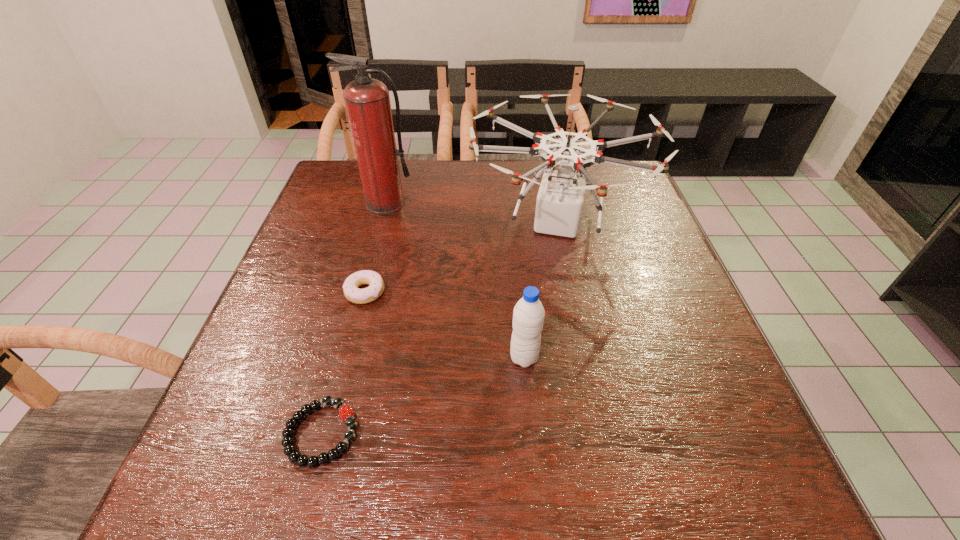
This screenshot has width=960, height=540. I want to click on vacant point located between the tallest object and the bracelet, so click(354, 319).

Identify the location of unoccupied position between the fire extinguisher and the second tallest object. Image resolution: width=960 pixels, height=540 pixels. (471, 213).

This screenshot has height=540, width=960. Find the location of `vacant area that lies between the water bottle and the second tallest object`. vacant area that lies between the water bottle and the second tallest object is located at coordinates (540, 290).

Find the location of `free space between the drone and the water bottle`. free space between the drone and the water bottle is located at coordinates (540, 290).

Identify the location of free space that is in between the bracelet and the fire extinguisher. This screenshot has width=960, height=540. (354, 319).

This screenshot has height=540, width=960. In order to click on free space between the fourth tallest object and the water bottle in this screenshot , I will do `click(444, 325)`.

The image size is (960, 540). What are the coordinates of `object that is the second closest to the third shortest object` in the screenshot? It's located at (346, 413).

Image resolution: width=960 pixels, height=540 pixels. In order to click on the fourth closest object to the nearest object in this screenshot , I will do `click(367, 100)`.

You are a GUI agent. You are given a task and a screenshot of the screen. Output one action in this format:
    pyautogui.click(x=<x>, y=<y>)
    Task: Click on the free space in the image that satisfies the following two spatial constraints: 1. on the front side of the water bottle; 2. on the right side of the second shortest object
    The height and width of the screenshot is (540, 960).
    Given the screenshot: What is the action you would take?
    pyautogui.click(x=348, y=357)

Locate an element on the screen. The height and width of the screenshot is (540, 960). vacant space that satisfies the following two spatial constraints: 1. on the front side of the water bottle; 2. on the right side of the doughnut is located at coordinates click(x=348, y=357).